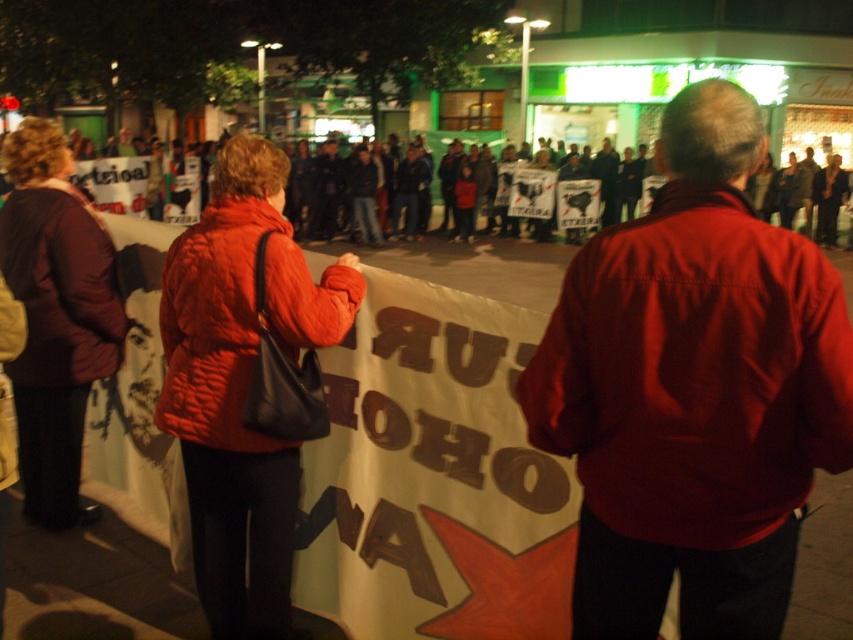
Can you confirm if quilted red jacket at center is positioned to the right of maroon fabric jacket at left?

Yes, quilted red jacket at center is to the right of maroon fabric jacket at left.

Can you confirm if quilted red jacket at center is positioned above maroon fabric jacket at left?

Incorrect, quilted red jacket at center is not positioned above maroon fabric jacket at left.

Locate an element on the screen. quilted red jacket at center is located at coordinates (239, 317).

The height and width of the screenshot is (640, 853). What do you see at coordinates (694, 371) in the screenshot?
I see `matte red jacket at center` at bounding box center [694, 371].

Is matte red jacket at center taller than maroon fabric jacket at left?

In fact, matte red jacket at center may be shorter than maroon fabric jacket at left.

Find the location of `matte red jacket at center`. matte red jacket at center is located at coordinates (694, 371).

Locate an element on the screen. The width and height of the screenshot is (853, 640). matte red jacket at center is located at coordinates (694, 371).

From the picture: Is matte red jacket at center taller than quilted red jacket at center?

Indeed, matte red jacket at center has a greater height compared to quilted red jacket at center.

Which of these two, matte red jacket at center or quilted red jacket at center, stands shorter?

With less height is quilted red jacket at center.

I want to click on matte red jacket at center, so click(x=694, y=371).